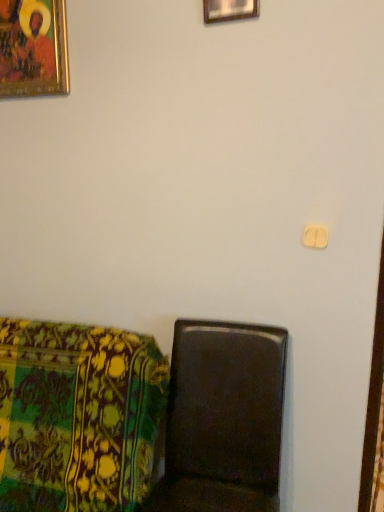
Question: Considering the relative positions of floral fabric cushion at lower left, the second furniture from the right, and gold-framed painting at upper left, the first picture frame when ordered from back to front, in the image provided, is floral fabric cushion at lower left, the second furniture from the right, to the left of gold-framed painting at upper left, the first picture frame when ordered from back to front, from the viewer's perspective?

Choices:
 (A) yes
 (B) no

Answer: (B)

Question: From a real-world perspective, is floral fabric cushion at lower left, the second furniture from the right, over gold-framed painting at upper left, which appears as the first picture frame when viewed from the left?

Choices:
 (A) yes
 (B) no

Answer: (B)

Question: From the image's perspective, does floral fabric cushion at lower left, which is the first furniture in left-to-right order, appear lower than gold-framed painting at upper left, the first picture frame when ordered from back to front?

Choices:
 (A) yes
 (B) no

Answer: (A)

Question: Could you tell me if floral fabric cushion at lower left, which is the first furniture in left-to-right order, is turned towards gold-framed painting at upper left, which is the second picture frame from right to left?

Choices:
 (A) no
 (B) yes

Answer: (A)

Question: Is the position of floral fabric cushion at lower left, which is the first furniture in left-to-right order, less distant than that of gold-framed painting at upper left, which appears as the first picture frame when viewed from the left?

Choices:
 (A) yes
 (B) no

Answer: (A)

Question: Does floral fabric cushion at lower left, which is the first furniture in left-to-right order, appear on the right side of gold-framed painting at upper left, which appears as the first picture frame when viewed from the left?

Choices:
 (A) no
 (B) yes

Answer: (B)

Question: From a real-world perspective, is gold-framed painting at upper left, the first picture frame when ordered from back to front, physically below floral fabric cushion at lower left, the second furniture from the right?

Choices:
 (A) yes
 (B) no

Answer: (B)

Question: Would you say gold-framed painting at upper left, which appears as the first picture frame when viewed from the left, is a long distance from floral fabric cushion at lower left, which is the first furniture in left-to-right order?

Choices:
 (A) no
 (B) yes

Answer: (B)

Question: Is gold-framed painting at upper left, the second picture frame viewed from the front, closer to camera compared to floral fabric cushion at lower left, which is the first furniture in left-to-right order?

Choices:
 (A) no
 (B) yes

Answer: (A)

Question: Does gold-framed painting at upper left, the second picture frame viewed from the front, have a smaller size compared to floral fabric cushion at lower left, the second furniture from the right?

Choices:
 (A) yes
 (B) no

Answer: (A)

Question: From the image's perspective, is gold-framed painting at upper left, which is the second picture frame from right to left, located beneath floral fabric cushion at lower left, the second furniture from the right?

Choices:
 (A) no
 (B) yes

Answer: (A)

Question: Is gold-framed painting at upper left, the first picture frame when ordered from back to front, located outside floral fabric cushion at lower left, which is the first furniture in left-to-right order?

Choices:
 (A) yes
 (B) no

Answer: (A)

Question: Can you confirm if matte brown chair at lower left, marked as the first furniture in a right-to-left arrangement, is shorter than gold-framed painting at upper left, which is the second picture frame from right to left?

Choices:
 (A) yes
 (B) no

Answer: (B)